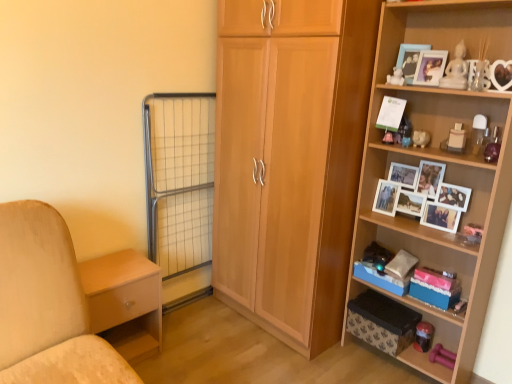
Where is `free space above blue cardboard storage box at lower right, the 1th storage box when ordered from top to bottom (from a real-world perspective)`? free space above blue cardboard storage box at lower right, the 1th storage box when ordered from top to bottom (from a real-world perspective) is located at coordinates (386, 264).